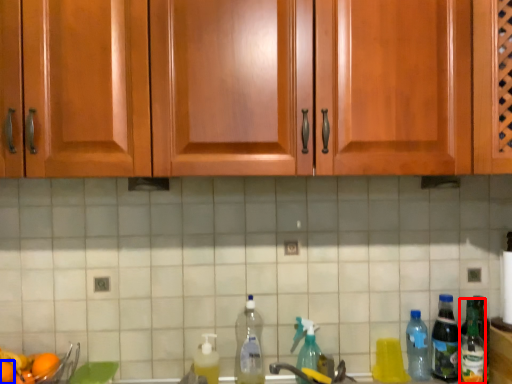
Question: Which object is further to the camera taking this photo, bottle (highlighted by a red box) or orange (highlighted by a blue box)?

Choices:
 (A) bottle
 (B) orange

Answer: (A)